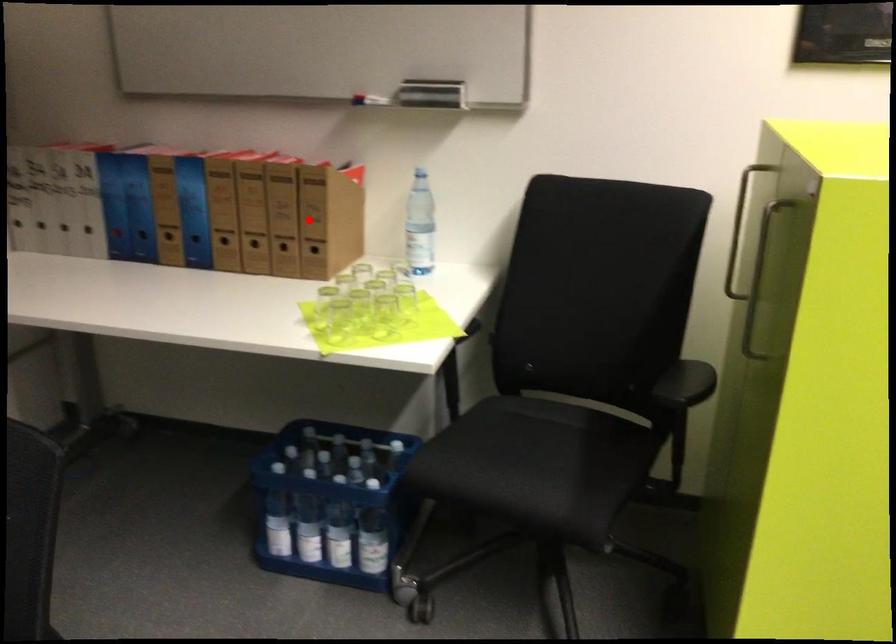
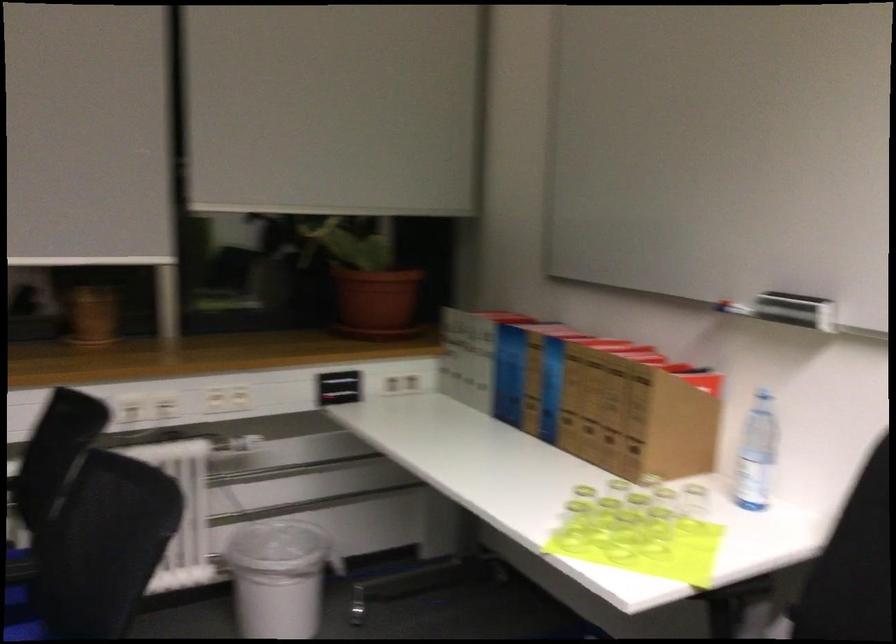
In the second image, find the point that corresponds to the highlighted location in the first image.

(634, 417)